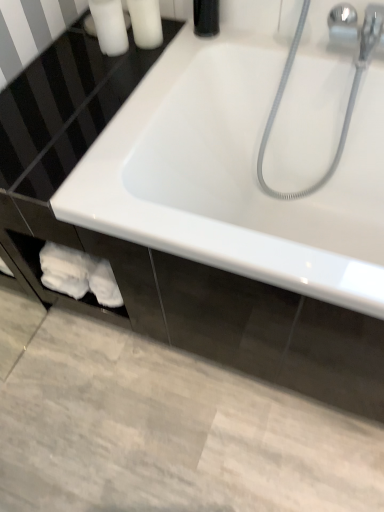
Find the location of a particular element. white matte bottle at upper left, arranged as the 2th toiletry when viewed from the left is located at coordinates (146, 23).

This screenshot has height=512, width=384. What are the coordinates of `white glossy bathtub at center` in the screenshot? It's located at (235, 175).

How much space does white matte soap at upper left, arranged as the 2th toiletry when viewed from the right, occupy horizontally?

3.80 inches.

This screenshot has height=512, width=384. What are the coordinates of `white matte bottle at upper left, placed as the first toiletry when sorted from right to left` in the screenshot? It's located at point(146,23).

From a real-world perspective, is white matte soap at upper left, arranged as the 2th toiletry when viewed from the right, positioned over white glossy bathtub at center based on gravity?

Correct, in the physical world, white matte soap at upper left, arranged as the 2th toiletry when viewed from the right, is higher than white glossy bathtub at center.

Based on the photo, based on their sizes in the image, would you say white matte soap at upper left, arranged as the 2th toiletry when viewed from the right, is bigger or smaller than white glossy bathtub at center?

Clearly, white matte soap at upper left, arranged as the 2th toiletry when viewed from the right, is smaller in size than white glossy bathtub at center.

Which object is positioned more to the left, white matte soap at upper left, arranged as the 2th toiletry when viewed from the right, or white glossy bathtub at center?

Positioned to the left is white matte soap at upper left, arranged as the 2th toiletry when viewed from the right.

Is white matte soap at upper left, arranged as the 2th toiletry when viewed from the right, wider or thinner than white glossy bathtub at center?

white matte soap at upper left, arranged as the 2th toiletry when viewed from the right, is thinner than white glossy bathtub at center.

Can we say white matte bottle at upper left, arranged as the 2th toiletry when viewed from the left, lies outside white matte soap at upper left, which ranks as the first toiletry in left-to-right order?

Yes.

From the image's perspective, is white matte bottle at upper left, arranged as the 2th toiletry when viewed from the left, below white matte soap at upper left, which ranks as the first toiletry in left-to-right order?

Actually, white matte bottle at upper left, arranged as the 2th toiletry when viewed from the left, appears above white matte soap at upper left, which ranks as the first toiletry in left-to-right order, in the image.

Is white matte bottle at upper left, arranged as the 2th toiletry when viewed from the left, taller or shorter than white matte soap at upper left, arranged as the 2th toiletry when viewed from the right?

Considering their sizes, white matte bottle at upper left, arranged as the 2th toiletry when viewed from the left, has less height than white matte soap at upper left, arranged as the 2th toiletry when viewed from the right.

From a real-world perspective, does white matte soap at upper left, arranged as the 2th toiletry when viewed from the right, stand above white matte bottle at upper left, placed as the first toiletry when sorted from right to left?

No, from a real-world perspective, white matte soap at upper left, arranged as the 2th toiletry when viewed from the right, is not over white matte bottle at upper left, placed as the first toiletry when sorted from right to left

Is white matte bottle at upper left, arranged as the 2th toiletry when viewed from the left, located within white matte soap at upper left, which ranks as the first toiletry in left-to-right order?

No, white matte bottle at upper left, arranged as the 2th toiletry when viewed from the left, is located outside of white matte soap at upper left, which ranks as the first toiletry in left-to-right order.

In the image, is white matte soap at upper left, which ranks as the first toiletry in left-to-right order, on the left side or the right side of white matte bottle at upper left, arranged as the 2th toiletry when viewed from the left?

Clearly, white matte soap at upper left, which ranks as the first toiletry in left-to-right order, is on the left of white matte bottle at upper left, arranged as the 2th toiletry when viewed from the left, in the image.

Which object is positioned more to the left, white glossy bathtub at center or white matte soap at upper left, which ranks as the first toiletry in left-to-right order?

From the viewer's perspective, white matte soap at upper left, which ranks as the first toiletry in left-to-right order, appears more on the left side.

From a real-world perspective, who is located lower, white glossy bathtub at center or white matte soap at upper left, which ranks as the first toiletry in left-to-right order?

white glossy bathtub at center is physically lower.

Does point (255, 189) lie in front of point (120, 37)?

No, (255, 189) is behind (120, 37).

From the image's perspective, is white glossy bathtub at center under white matte soap at upper left, which ranks as the first toiletry in left-to-right order?

Yes.

Based on their sizes in the image, would you say white matte bottle at upper left, placed as the first toiletry when sorted from right to left, is bigger or smaller than white glossy bathtub at center?

Clearly, white matte bottle at upper left, placed as the first toiletry when sorted from right to left, is smaller in size than white glossy bathtub at center.

Considering the sizes of objects white matte bottle at upper left, placed as the first toiletry when sorted from right to left, and white glossy bathtub at center in the image provided, who is shorter, white matte bottle at upper left, placed as the first toiletry when sorted from right to left, or white glossy bathtub at center?

white matte bottle at upper left, placed as the first toiletry when sorted from right to left, is shorter.

From the image's perspective, which is above, white matte bottle at upper left, placed as the first toiletry when sorted from right to left, or white glossy bathtub at center?

white matte bottle at upper left, placed as the first toiletry when sorted from right to left, from the image's perspective.

Is white glossy bathtub at center not close to white matte bottle at upper left, placed as the first toiletry when sorted from right to left?

white glossy bathtub at center is actually quite close to white matte bottle at upper left, placed as the first toiletry when sorted from right to left.

Is white glossy bathtub at center spatially inside white matte bottle at upper left, placed as the first toiletry when sorted from right to left, or outside of it?

white glossy bathtub at center is outside white matte bottle at upper left, placed as the first toiletry when sorted from right to left.

Is white glossy bathtub at center positioned in front of white matte bottle at upper left, placed as the first toiletry when sorted from right to left?

Yes, the depth of white glossy bathtub at center is less than that of white matte bottle at upper left, placed as the first toiletry when sorted from right to left.

In the scene shown: Considering the sizes of objects white glossy bathtub at center and white matte bottle at upper left, placed as the first toiletry when sorted from right to left, in the image provided, who is thinner, white glossy bathtub at center or white matte bottle at upper left, placed as the first toiletry when sorted from right to left,?

Thinner between the two is white matte bottle at upper left, placed as the first toiletry when sorted from right to left.

Identify the location of bathtub in front of the white matte soap at upper left, arranged as the 2th toiletry when viewed from the right. (235, 175).

The width and height of the screenshot is (384, 512). Find the location of `toiletry on the left side of white matte bottle at upper left, placed as the first toiletry when sorted from right to left`. toiletry on the left side of white matte bottle at upper left, placed as the first toiletry when sorted from right to left is located at coordinates (109, 26).

From the image, which object appears to be farther from white glossy bathtub at center, white matte soap at upper left, arranged as the 2th toiletry when viewed from the right, or white matte bottle at upper left, placed as the first toiletry when sorted from right to left?

The object further to white glossy bathtub at center is white matte soap at upper left, arranged as the 2th toiletry when viewed from the right.

Which object lies further to the anchor point white matte bottle at upper left, arranged as the 2th toiletry when viewed from the left, white matte soap at upper left, arranged as the 2th toiletry when viewed from the right, or white glossy bathtub at center?

white glossy bathtub at center is further to white matte bottle at upper left, arranged as the 2th toiletry when viewed from the left.

From the image, which object appears to be farther from white matte soap at upper left, which ranks as the first toiletry in left-to-right order, white glossy bathtub at center or white matte bottle at upper left, placed as the first toiletry when sorted from right to left?

white glossy bathtub at center lies further to white matte soap at upper left, which ranks as the first toiletry in left-to-right order, than the other object.

Which object lies further to the anchor point white glossy bathtub at center, white matte bottle at upper left, arranged as the 2th toiletry when viewed from the left, or white matte soap at upper left, arranged as the 2th toiletry when viewed from the right?

white matte soap at upper left, arranged as the 2th toiletry when viewed from the right, is positioned further to the anchor white glossy bathtub at center.

Considering their positions, is white glossy bathtub at center positioned closer to white matte bottle at upper left, arranged as the 2th toiletry when viewed from the left, than white matte soap at upper left, arranged as the 2th toiletry when viewed from the right?

white matte soap at upper left, arranged as the 2th toiletry when viewed from the right, is positioned closer to the anchor white matte bottle at upper left, arranged as the 2th toiletry when viewed from the left.

Looking at the image, which one is located further to white matte soap at upper left, arranged as the 2th toiletry when viewed from the right, white matte bottle at upper left, placed as the first toiletry when sorted from right to left, or white glossy bathtub at center?

white glossy bathtub at center lies further to white matte soap at upper left, arranged as the 2th toiletry when viewed from the right, than the other object.

This screenshot has height=512, width=384. Identify the location of toiletry between white matte bottle at upper left, placed as the first toiletry when sorted from right to left, and white glossy bathtub at center in the up-down direction. (109, 26).